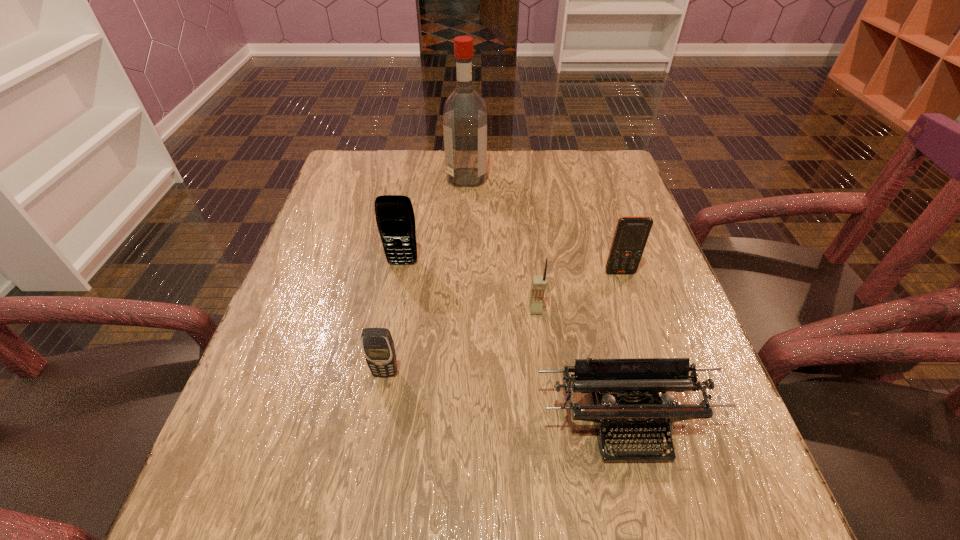
You are a GUI agent. You are given a task and a screenshot of the screen. Output one action in this format:
    pyautogui.click(x=<x>, y=<y>)
    Task: Click on the typewriter
    The width and height of the screenshot is (960, 540).
    Given the screenshot: What is the action you would take?
    pyautogui.click(x=628, y=412)

At what (x,y) coordinates should I click in order to perform the action: click on vacant space located on the front-facing side of the third object from left to right. Please return your answer as a coordinate pair (x, y). Looking at the image, I should click on (619, 178).

The image size is (960, 540). I want to click on vacant region located on the screen of the farthest cellular telephone, so click(377, 401).

This screenshot has height=540, width=960. I want to click on free region located 0.390m on the screen of the rightmost cellular telephone, so click(x=676, y=448).

At what (x,y) coordinates should I click in order to perform the action: click on blank space located on the front of the second nearest cellular telephone, where the keypad is located. Please return your answer as a coordinate pair (x, y). Looking at the image, I should click on (539, 335).

Find the location of `free point located 0.080m on the front face of the shortest cellular telephone`. free point located 0.080m on the front face of the shortest cellular telephone is located at coordinates (377, 420).

Where is `vacant space situated 0.080m on the typing side of the shortest object`? This screenshot has height=540, width=960. vacant space situated 0.080m on the typing side of the shortest object is located at coordinates (652, 521).

Find the location of `object present at the far edge`. object present at the far edge is located at coordinates (465, 112).

Locate an element on the screen. This screenshot has width=960, height=540. cellular telephone located at the right edge is located at coordinates (631, 234).

Find the location of `typewriter that is positioned at the right edge`. typewriter that is positioned at the right edge is located at coordinates (628, 412).